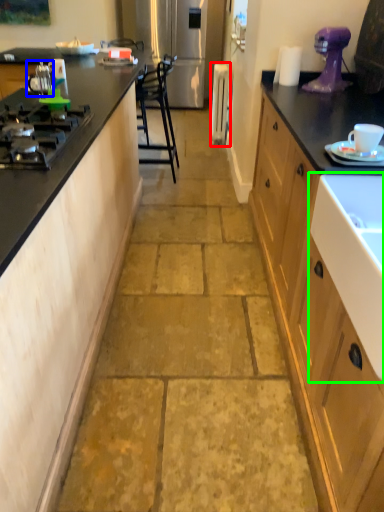
Question: Based on their relative distances, which object is nearer to appliance (highlighted by a red box)? Choose from appliance (highlighted by a blue box) and sink (highlighted by a green box).

Choices:
 (A) appliance
 (B) sink

Answer: (A)